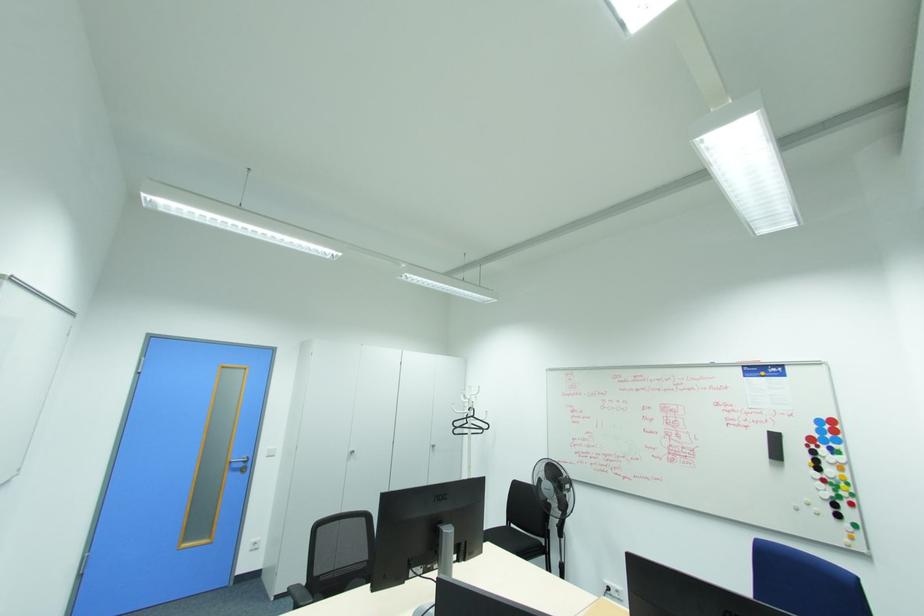
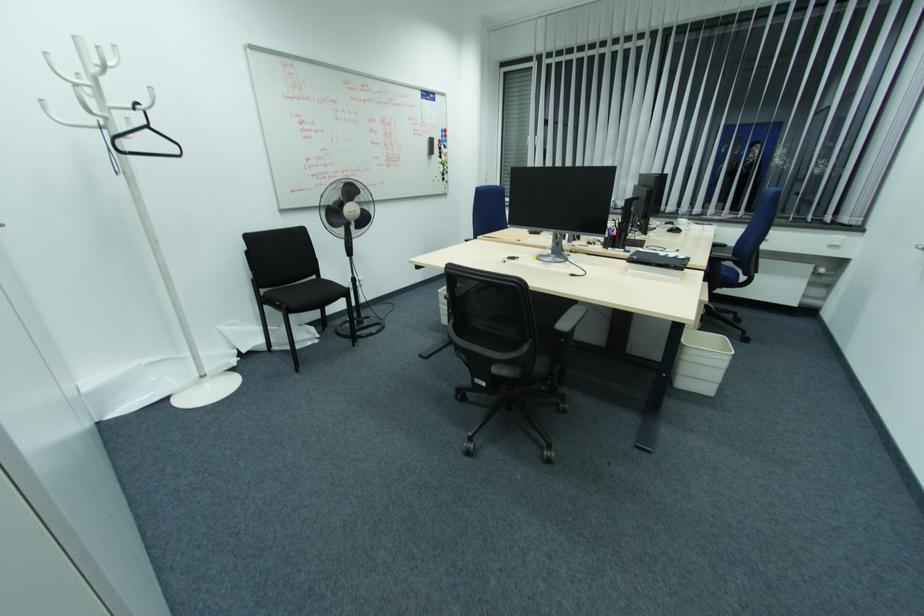
The point at [833,446] is marked in the first image. Where is the corresponding point in the second image?

(445, 144)